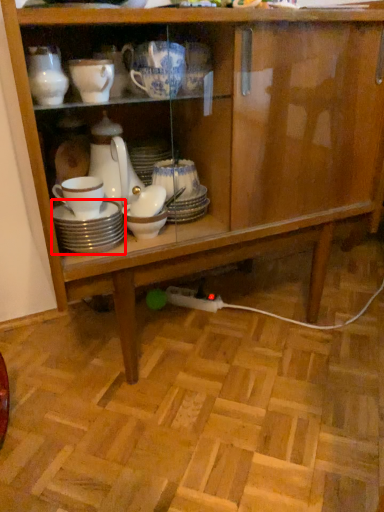
Question: From the image's perspective, considering the relative positions of tableware (annotated by the red box) and tableware in the image provided, where is tableware (annotated by the red box) located with respect to the staircase?

Choices:
 (A) below
 (B) above

Answer: (A)